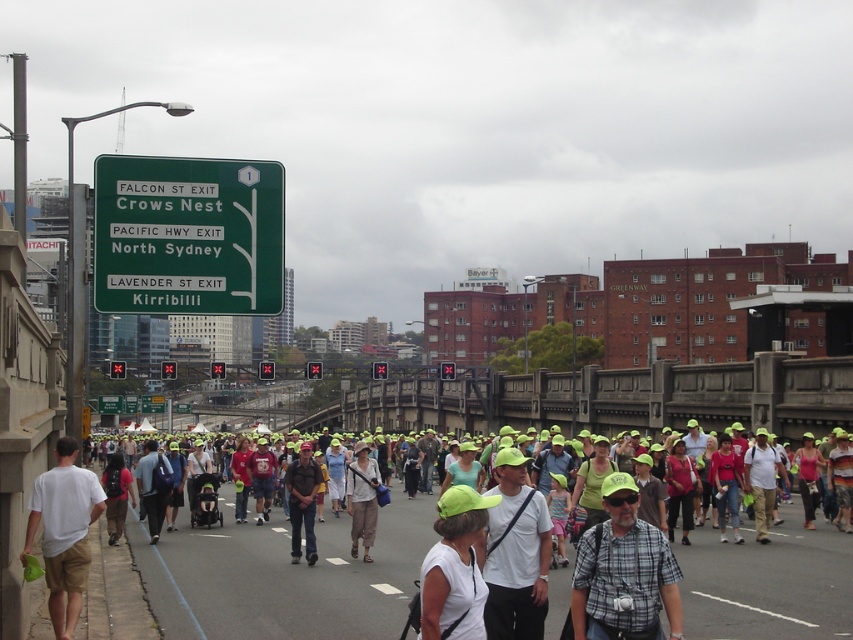
Who is more forward, [158,561] or [354,484]?

Positioned in front is point [354,484].

Measure the distance between smooth asphalt road at center and light beige cotton shirt at center.

smooth asphalt road at center is 2.69 meters away from light beige cotton shirt at center.

Between point (846, 602) and point (372, 492), which one is positioned behind?

Point (372, 492)

Where is `smooth asphalt road at center`? smooth asphalt road at center is located at coordinates (283, 577).

Based on the photo, does plaid shirt at center have a smaller size compared to dark brown leather jacket at center?

Correct, plaid shirt at center occupies less space than dark brown leather jacket at center.

Does point (666, 600) come closer to viewer compared to point (300, 452)?

That is True.

Where is `plaid shirt at center`? plaid shirt at center is located at coordinates (624, 572).

Measure the distance from smooth asphalt road at center to white cotton t-shirt at left.

smooth asphalt road at center and white cotton t-shirt at left are 7.57 meters apart.

In the scene shown: Is smooth asphalt road at center thinner than white cotton t-shirt at left?

No.

Image resolution: width=853 pixels, height=640 pixels. What do you see at coordinates (283, 577) in the screenshot? I see `smooth asphalt road at center` at bounding box center [283, 577].

At what (x,y) coordinates should I click in order to perform the action: click on smooth asphalt road at center. Please return your answer as a coordinate pair (x, y). Looking at the image, I should click on (283, 577).